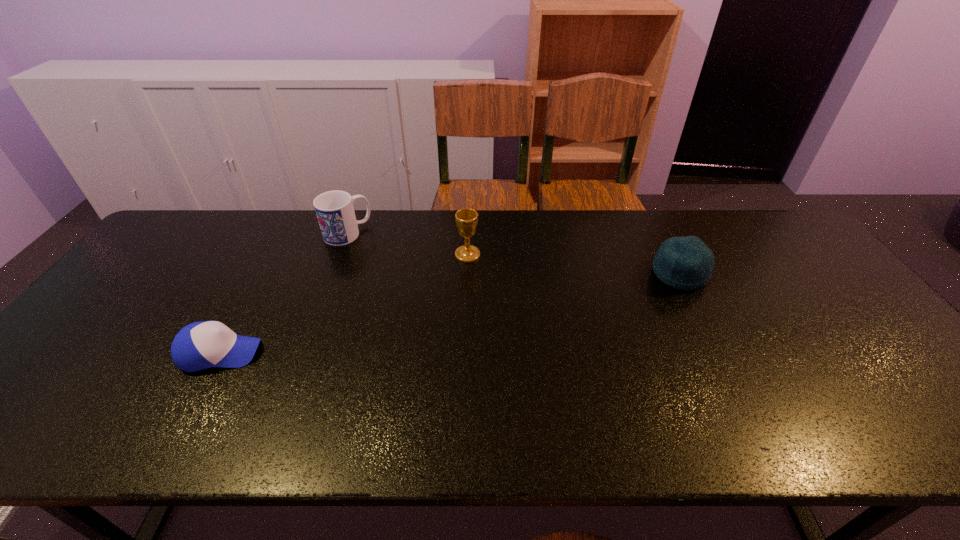
Where is `chalice`? The image size is (960, 540). chalice is located at coordinates (466, 219).

Where is `mug`? mug is located at coordinates (334, 209).

Where is `the second object from left to right`? The width and height of the screenshot is (960, 540). the second object from left to right is located at coordinates (334, 209).

Where is `the rightmost object`? The width and height of the screenshot is (960, 540). the rightmost object is located at coordinates (686, 263).

Identify the location of the nearest object. This screenshot has width=960, height=540. (200, 345).

Locate an element on the screen. The width and height of the screenshot is (960, 540). the leftmost object is located at coordinates (200, 345).

This screenshot has height=540, width=960. Find the location of `vacant space located 0.150m on the back of the second object from right to left`. vacant space located 0.150m on the back of the second object from right to left is located at coordinates (468, 220).

Locate an element on the screen. This screenshot has width=960, height=540. vacant space positioned on the right of the third object from right to left is located at coordinates (492, 234).

Where is `free space located 0.170m on the front of the beanie`? free space located 0.170m on the front of the beanie is located at coordinates (713, 340).

Find the location of a particular element. This screenshot has height=540, width=960. vacant point located 0.140m on the front-facing side of the baseball cap is located at coordinates (318, 353).